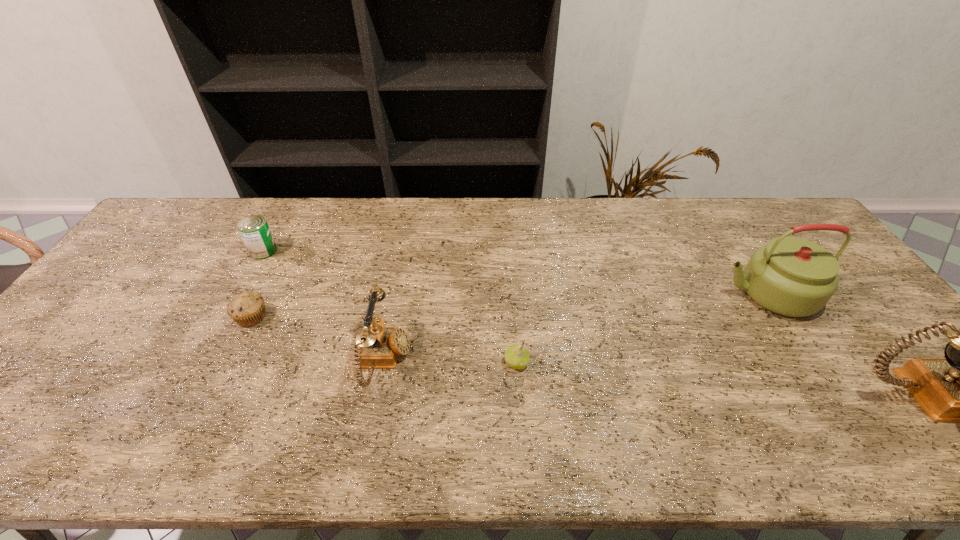
At what (x,y) coordinates should I click in order to perform the action: click on vacant space located at the spout of the kettle. Please return your answer as a coordinate pair (x, y). Image resolution: width=960 pixels, height=540 pixels. Looking at the image, I should click on (628, 293).

Locate an element on the screen. This screenshot has width=960, height=540. vacant area situated at the spout of the kettle is located at coordinates (645, 293).

The image size is (960, 540). In order to click on free space located at the spout of the kettle in this screenshot , I will do `click(638, 293)`.

Where is `object positioned at the near edge`? This screenshot has width=960, height=540. object positioned at the near edge is located at coordinates (380, 346).

Identify the location of object present at the right edge. The height and width of the screenshot is (540, 960). (791, 276).

In the image, there is a desktop. Where is `free space at the far edge`? This screenshot has width=960, height=540. free space at the far edge is located at coordinates (625, 226).

At what (x,y) coordinates should I click in order to perform the action: click on free region at the near edge. Please return your answer as a coordinate pair (x, y). The width and height of the screenshot is (960, 540). Looking at the image, I should click on (602, 415).

Identify the location of free space at the right edge. The height and width of the screenshot is (540, 960). (869, 316).

Identify the location of vacant area that lies between the shortest object and the third object from left to right. (318, 339).

In order to click on vacant point located between the can and the fourth object from left to right in this screenshot , I will do `click(390, 307)`.